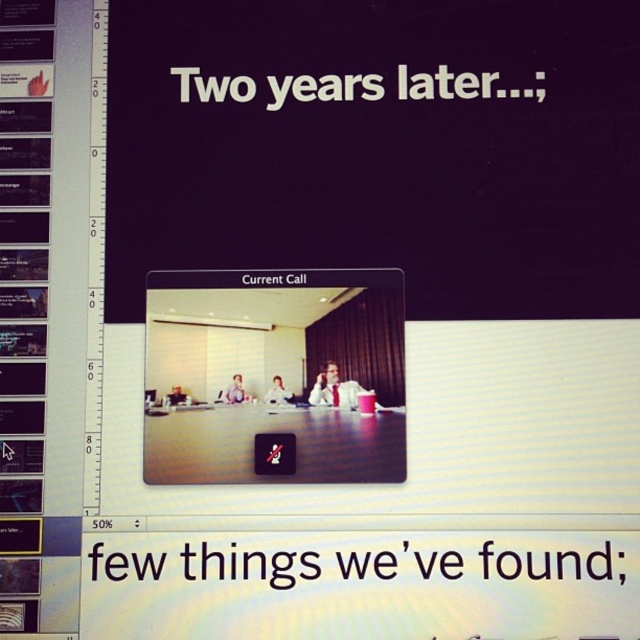
You are preparing to give a presentation and want to ensure your slides are clear. You notice the matte black screen at center and the black plastic text at center on your current slide. Which of these elements is taller?

The matte black screen at center is taller than the black plastic text at center.

You are preparing to give a presentation and need to adjust the slide layout. The slide has a matte black screen at center and a black plastic text at center. Which object should you enlarge to make sure the text is more prominent without overlapping the other elements?

The matte black screen at center is thinner than black plastic text at center, so enlarging the black plastic text at center would make the text more prominent without overlapping other elements since it is already wider.

You are a remote worker trying to join a video call. You see the Current Call interface and a point at coordinates (x=273, y=376). What object is located at that point?

The point at coordinates (x=273, y=376) indicates the matte black screen at center.